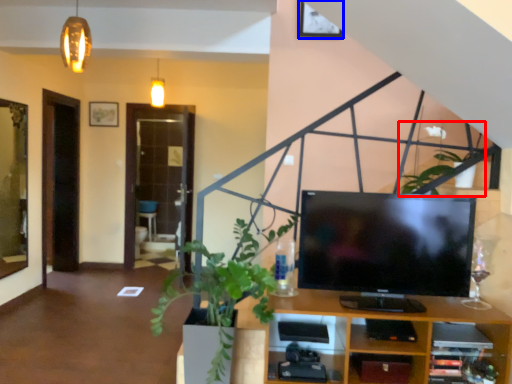
Question: Which object is closer to the camera taking this photo, plant (highlighted by a red box) or picture frame (highlighted by a blue box)?

Choices:
 (A) plant
 (B) picture frame

Answer: (A)